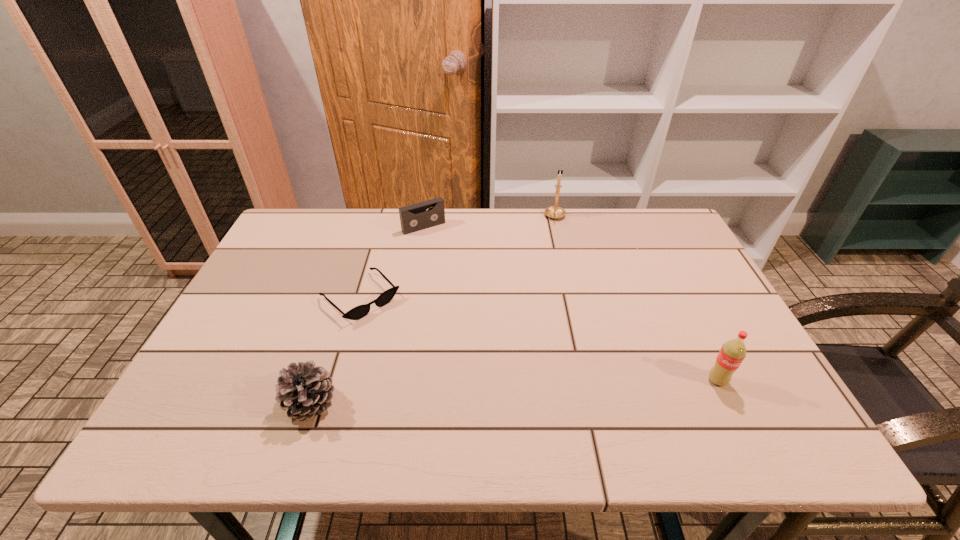
At what (x,y) coordinates should I click in order to perform the action: click on pinecone. Please return your answer as a coordinate pair (x, y). This screenshot has width=960, height=540. Looking at the image, I should click on (304, 390).

Locate an element on the screen. The image size is (960, 540). soda is located at coordinates (733, 352).

Locate an element on the screen. Image resolution: width=960 pixels, height=540 pixels. candle holder is located at coordinates [x=555, y=212].

Locate an element on the screen. The image size is (960, 540). the shortest object is located at coordinates (358, 312).

Image resolution: width=960 pixels, height=540 pixels. Find the location of `the third farthest object`. the third farthest object is located at coordinates (358, 312).

What are the coordinates of `videotape` in the screenshot? It's located at (414, 217).

Locate an element on the screen. The width and height of the screenshot is (960, 540). free space located on the right of the pinecone is located at coordinates (385, 403).

In order to click on blank space located 0.130m on the back of the rightmost object in this screenshot , I will do `click(692, 329)`.

This screenshot has width=960, height=540. What are the coordinates of `free region located on the handle side of the candle holder` in the screenshot? It's located at (555, 272).

At what (x,y) coordinates should I click in order to perform the action: click on free space located 0.340m on the handle side of the candle holder. Please return your answer as a coordinate pair (x, y). Looking at the image, I should click on click(555, 295).